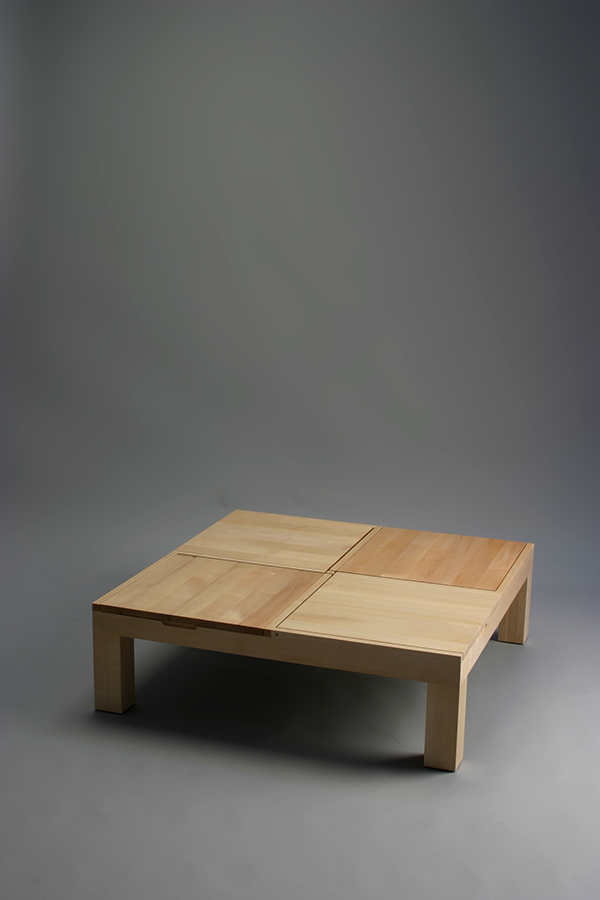
The image size is (600, 900). Identify the location of right top corner of table. (426, 554).